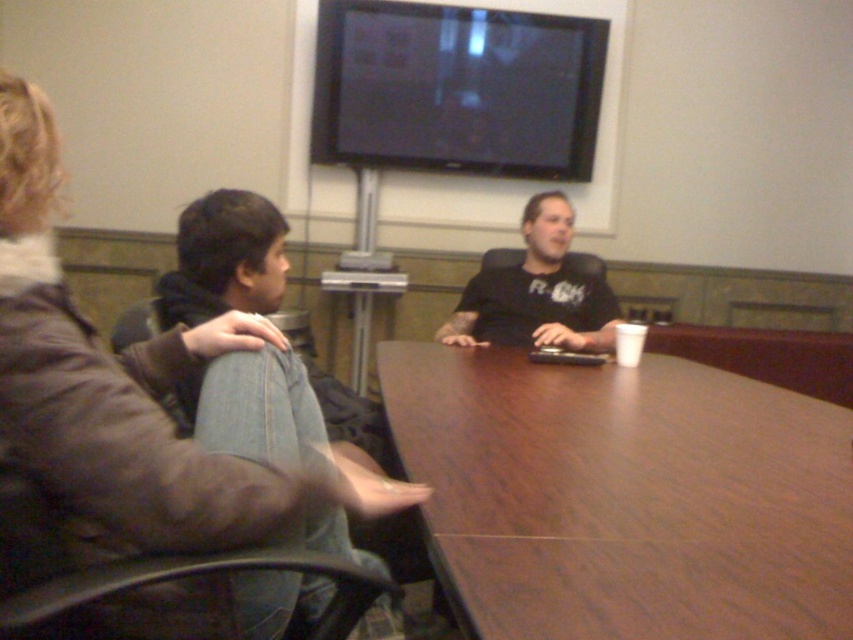
Between brown wood table at center and dark brown leather jacket at upper left, which one has less height?

Standing shorter between the two is brown wood table at center.

Does brown wood table at center appear on the right side of dark brown leather jacket at upper left?

Correct, you'll find brown wood table at center to the right of dark brown leather jacket at upper left.

Is point (769, 392) positioned after point (44, 144)?

Yes, it is behind point (44, 144).

Image resolution: width=853 pixels, height=640 pixels. Find the location of `brown wood table at center`. brown wood table at center is located at coordinates [625, 497].

At what (x,y) coordinates should I click in order to perform the action: click on brown wood table at center. Please return your answer as a coordinate pair (x, y). The width and height of the screenshot is (853, 640). Looking at the image, I should click on (625, 497).

Between brown wood table at center and black matte shirt at center, which one has less height?

brown wood table at center is shorter.

The width and height of the screenshot is (853, 640). I want to click on brown wood table at center, so click(625, 497).

Is dark brown leather jacket at upper left smaller than black matte shirt at center?

Yes, dark brown leather jacket at upper left is smaller than black matte shirt at center.

Can you confirm if dark brown leather jacket at upper left is taller than black matte shirt at center?

Indeed, dark brown leather jacket at upper left has a greater height compared to black matte shirt at center.

Is point (218, 396) less distant than point (572, 307)?

Yes, it is in front of point (572, 307).

Find the location of a particular element. The image size is (853, 640). dark brown leather jacket at upper left is located at coordinates (143, 412).